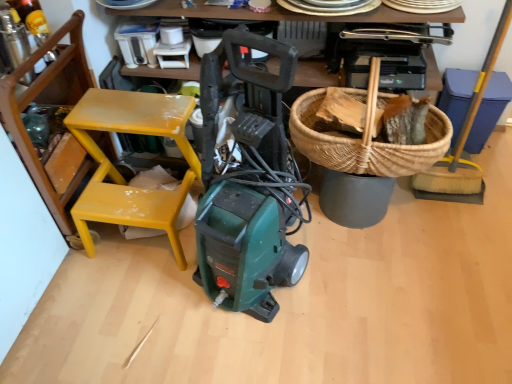
At what (x,y) coordinates should I click in order to perform the action: click on free space in front of yellow painted wood chair at left. Please return your answer as a coordinate pair (x, y). The width and height of the screenshot is (512, 384). Looking at the image, I should click on (131, 313).